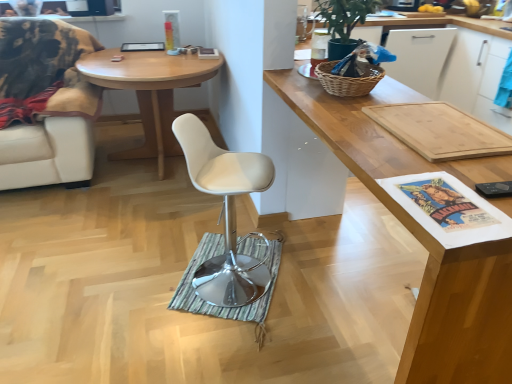
The image size is (512, 384). I want to click on blank space situated above green striped mat at center (from a real-world perspective), so click(x=225, y=266).